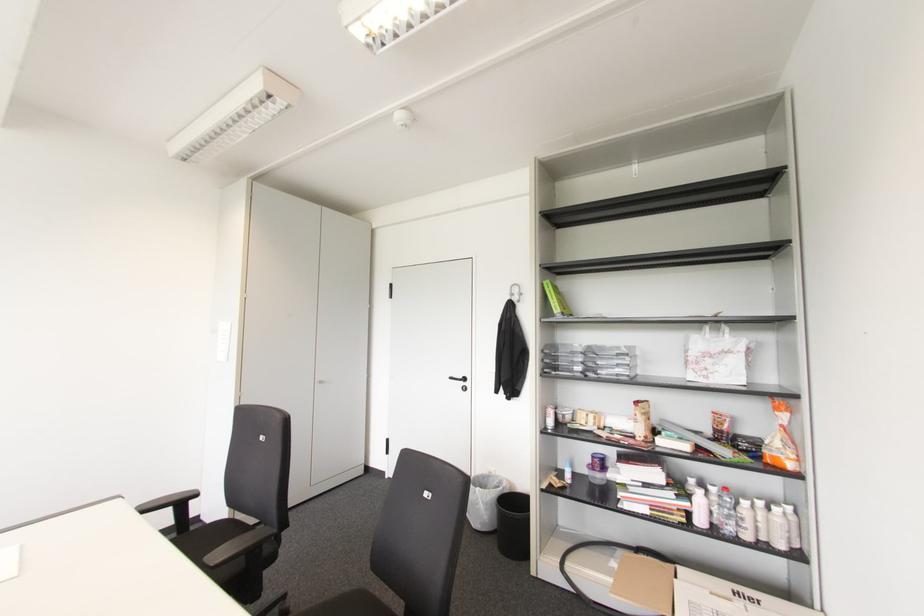
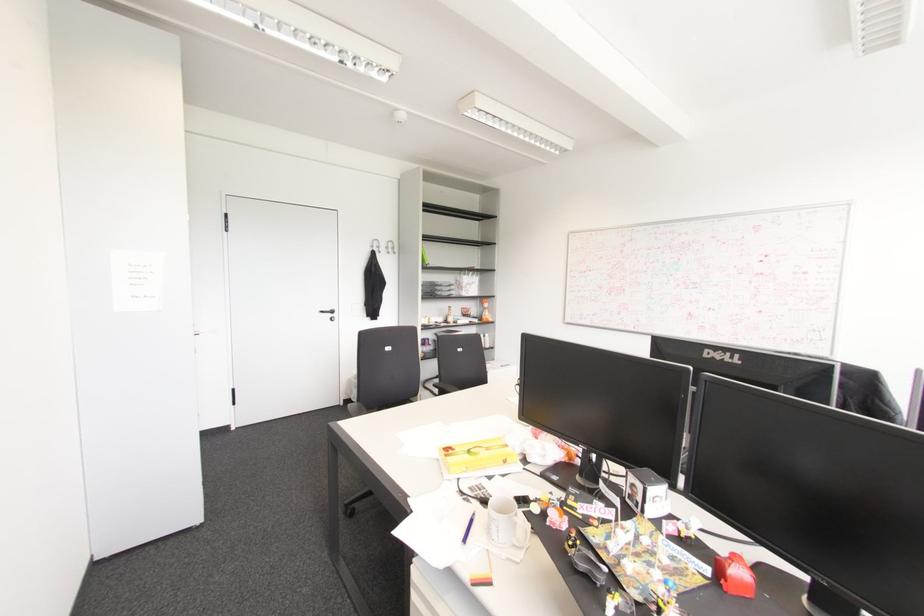
In the second image, find the point that corresponds to (x=464, y=379) in the first image.

(332, 310)